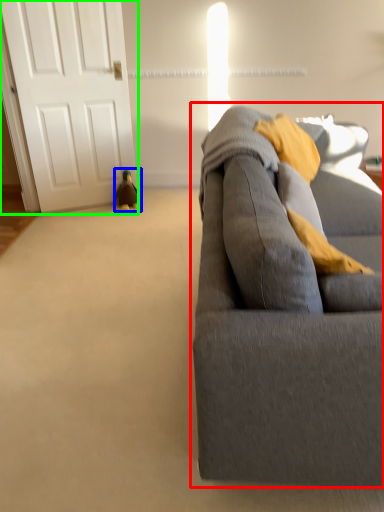
Question: Which object is positioned closest to studio couch (highlighted by a red box)? Select from toy (highlighted by a blue box) and door (highlighted by a green box).

Choices:
 (A) toy
 (B) door

Answer: (B)